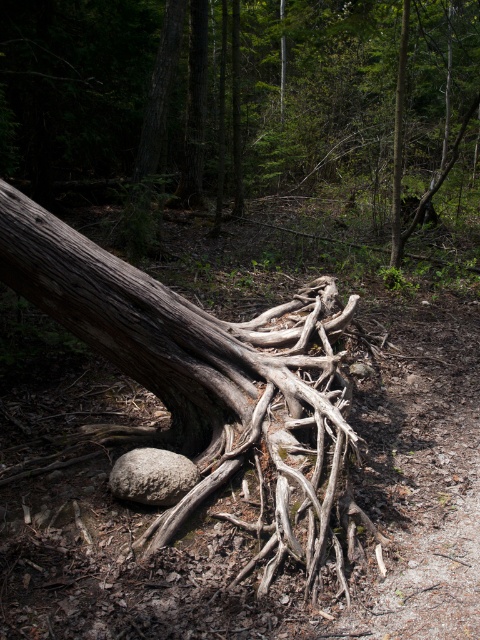
Question: Estimate the real-world distances between objects in this image. Which object is closer to the drab brown roots at center?

Choices:
 (A) gray rough boulder at center
 (B) grayish-brown wood at center

Answer: (B)

Question: Observing the image, what is the correct spatial positioning of drab brown roots at center in reference to gray rough boulder at center?

Choices:
 (A) left
 (B) right

Answer: (B)

Question: Is drab brown roots at center wider than gray rough boulder at center?

Choices:
 (A) yes
 (B) no

Answer: (A)

Question: Considering the real-world distances, which object is closest to the grayish-brown wood at center?

Choices:
 (A) gray rough boulder at center
 (B) drab brown roots at center

Answer: (A)

Question: Which of the following is the farthest from the observer?

Choices:
 (A) (173, 458)
 (B) (271, 193)

Answer: (B)

Question: Does grayish-brown wood at center appear under gray rough boulder at center?

Choices:
 (A) yes
 (B) no

Answer: (B)